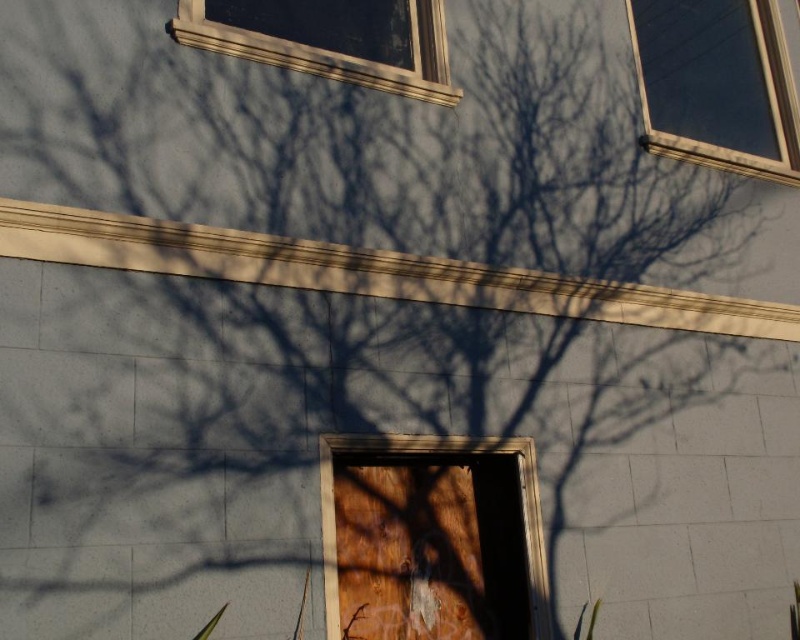
Can you confirm if clear glass window at upper right is bigger than wooden door at center?

Correct, clear glass window at upper right is larger in size than wooden door at center.

Is clear glass window at upper right below wooden door at center?

Actually, clear glass window at upper right is above wooden door at center.

Is point (754, 112) positioned in front of point (538, 515)?

No, (754, 112) is further to viewer.

You are a GUI agent. You are given a task and a screenshot of the screen. Output one action in this format:
    pyautogui.click(x=<x>, y=<y>)
    Task: Click on the clear glass window at upper right
    
    Given the screenshot: What is the action you would take?
    point(716,84)

Between clear glass window at upper center and wooden door at center, which one appears on the right side from the viewer's perspective?

Positioned to the right is wooden door at center.

Does clear glass window at upper center appear over wooden door at center?

Yes, clear glass window at upper center is above wooden door at center.

Is point (436, 56) closer to camera compared to point (532, 512)?

No, (436, 56) is behind (532, 512).

I want to click on clear glass window at upper center, so click(x=332, y=48).

Is point (754, 163) positioned after point (400, 93)?

Yes, point (754, 163) is behind point (400, 93).

Is clear glass window at upper right bigger than clear glass window at upper center?

Correct, clear glass window at upper right is larger in size than clear glass window at upper center.

Who is more distant from viewer, (700, 36) or (440, 42)?

Point (700, 36)

Where is `clear glass window at upper right`? clear glass window at upper right is located at coordinates (716, 84).